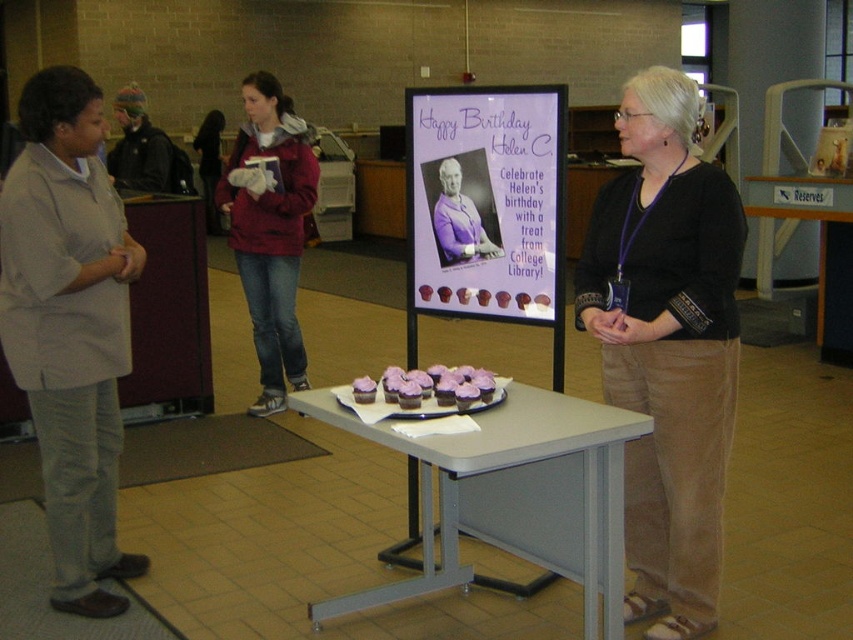
You are organizing a clothing rack in a store and need to place the black cotton shirt at center and the light gray shirt at left. If the rack has a width of 6 feet, will both shirts fit side by side without overlapping?

The black cotton shirt at center and the light gray shirt at left are 5.34 feet apart, so they can fit side by side on a 6 feet wide rack since 5.34 feet is less than 6 feet.

You are a visitor at this indoor location and want to take a photo of both the black cotton shirt at center and the purple paper poster at center. Since you want to ensure both are fully visible in the frame, which object should you position closer to the camera to avoid cropping?

The black cotton shirt at center is taller than the purple paper poster at center, so you should position the black cotton shirt at center closer to the camera to ensure its full height is captured without cropping.

A person is standing in front of the library desk and wants to place a cupcake from the tray onto the black cotton shirt at center. Can they do this without moving the shirt?

The black cotton shirt at center is located at point (666, 346). Since the shirt is already at the center, placing a cupcake from the tray onto it would require moving the shirt to make space, so it is not possible without moving the shirt.